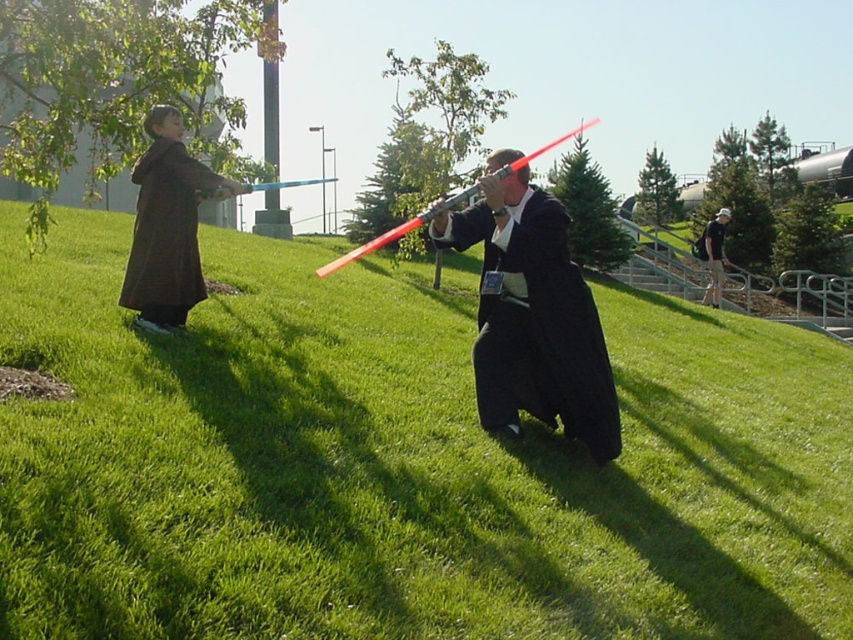
Image resolution: width=853 pixels, height=640 pixels. Describe the element at coordinates (401, 464) in the screenshot. I see `green grassy at center` at that location.

Is point (67, 291) positioned before point (508, 387)?

No, it is not.

Between point (344, 456) and point (540, 234), which one is positioned behind?

The point (540, 234) is behind.

I want to click on green grassy at center, so click(x=401, y=464).

Is black matte robe at center smaller than matte brown robe at left?

Yes, black matte robe at center is smaller than matte brown robe at left.

Who is positioned more to the right, black matte robe at center or matte brown robe at left?

From the viewer's perspective, black matte robe at center appears more on the right side.

What do you see at coordinates (535, 324) in the screenshot?
I see `black matte robe at center` at bounding box center [535, 324].

The height and width of the screenshot is (640, 853). Identify the location of black matte robe at center. (535, 324).

Is green grassy at center to the right of matte brown robe at left from the viewer's perspective?

Indeed, green grassy at center is positioned on the right side of matte brown robe at left.

Between point (207, 628) and point (161, 204), which one is positioned behind?

Point (161, 204)

Identify the location of green grassy at center. (401, 464).